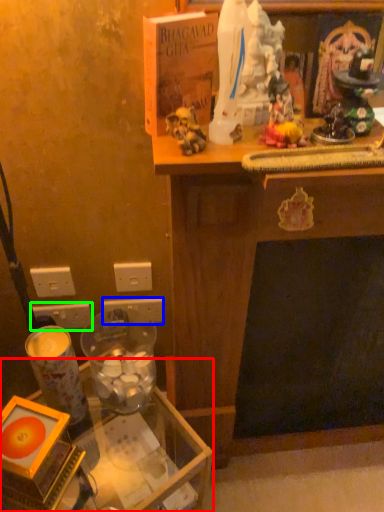
Question: Which is farther away from table (highlighted by a red box)? electric outlet (highlighted by a blue box) or electric outlet (highlighted by a green box)?

Choices:
 (A) electric outlet
 (B) electric outlet

Answer: (B)